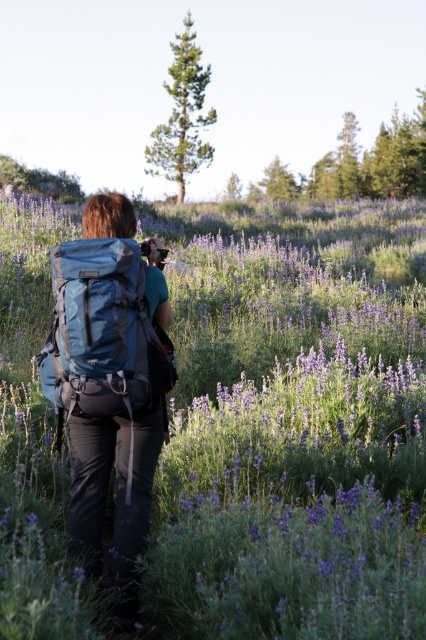
You are a photographer trying to capture a clear view of the purple soft lavender at center. However, the matte blue backpack at center is blocking your shot. Can you move the backpack to the side to get a better angle?

The purple soft lavender at center is in front of the matte blue backpack at center, so moving the backpack might not be necessary. The lavender is already positioned in front, so adjusting your angle or moving slightly backward could provide a clearer view without disturbing the backpack.

You are a photographer trying to capture the purple soft lavender at center and the teal fabric backpack at center in the same frame. Based on their positions, which object should you focus on first to ensure both are in focus?

The purple soft lavender at center is above the teal fabric backpack at center, so you should focus on the purple soft lavender at center first to ensure both are in focus since it is farther away.

You are a photographer aiming to capture the entire scene of the wildflower field and the tall coniferous trees in the background. You notice a matte blue backpack at center located at point (x=111, y=381). To ensure the backpack doesn not block the view of the trees, where should you position yourself relative to the backpack?

You should position yourself behind the matte blue backpack at center so that it is between you and the trees, allowing the backpack to be in the foreground while the trees remain visible in the background.